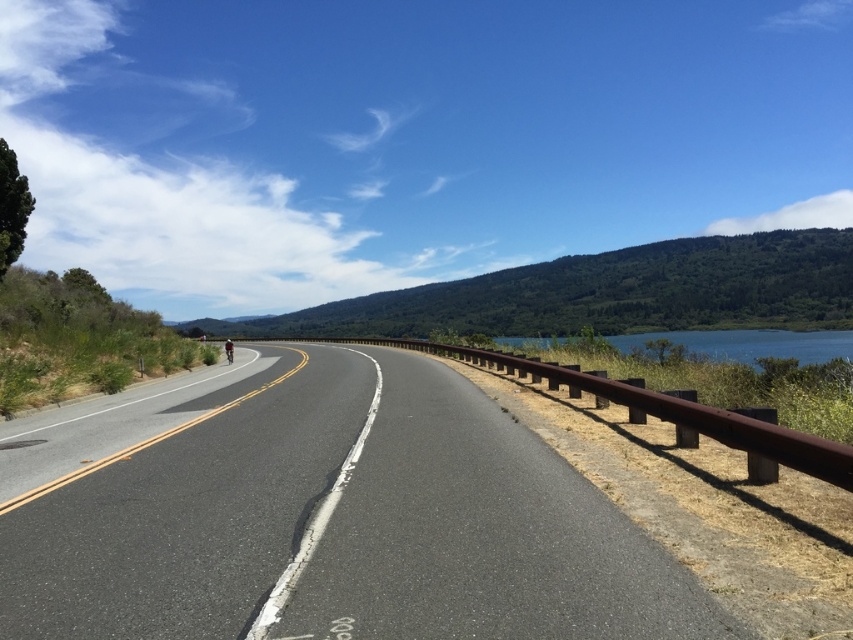
Question: Which of the following is the closest to the observer?

Choices:
 (A) blue water at upper right
 (B) asphalt road at center

Answer: (B)

Question: Does asphalt road at center have a larger size compared to blue water at upper right?

Choices:
 (A) no
 (B) yes

Answer: (A)

Question: Observing the image, what is the correct spatial positioning of asphalt road at center in reference to blue water at upper right?

Choices:
 (A) right
 (B) left

Answer: (B)

Question: Which object appears farthest from the camera in this image?

Choices:
 (A) blue water at upper right
 (B) asphalt road at center

Answer: (A)

Question: Is asphalt road at center thinner than blue water at upper right?

Choices:
 (A) no
 (B) yes

Answer: (B)